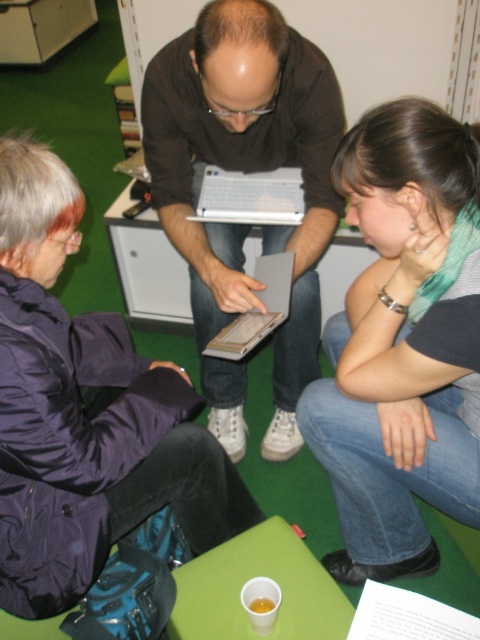
Does point (232, 204) lie behind point (262, 321)?

That is True.

Locate an element on the screen. This screenshot has width=480, height=640. silver metallic laptop at center is located at coordinates (251, 196).

Identify the location of silver metallic laptop at center. (251, 196).

Is denim jeans at lower right to the right of silver metallic laptop at center from the viewer's perspective?

Correct, you'll find denim jeans at lower right to the right of silver metallic laptop at center.

Can you confirm if denim jeans at lower right is wider than silver metallic laptop at center?

Indeed, denim jeans at lower right has a greater width compared to silver metallic laptop at center.

At what (x,y) coordinates should I click in order to perform the action: click on denim jeans at lower right. Please return your answer as a coordinate pair (x, y). Looking at the image, I should click on (403, 342).

Is purple satin jacket at upper left wider than matte black laptop at center?

In fact, purple satin jacket at upper left might be narrower than matte black laptop at center.

Which is more to the right, purple satin jacket at upper left or matte black laptop at center?

Positioned to the right is matte black laptop at center.

Where is `purple satin jacket at upper left`? This screenshot has height=640, width=480. purple satin jacket at upper left is located at coordinates (84, 412).